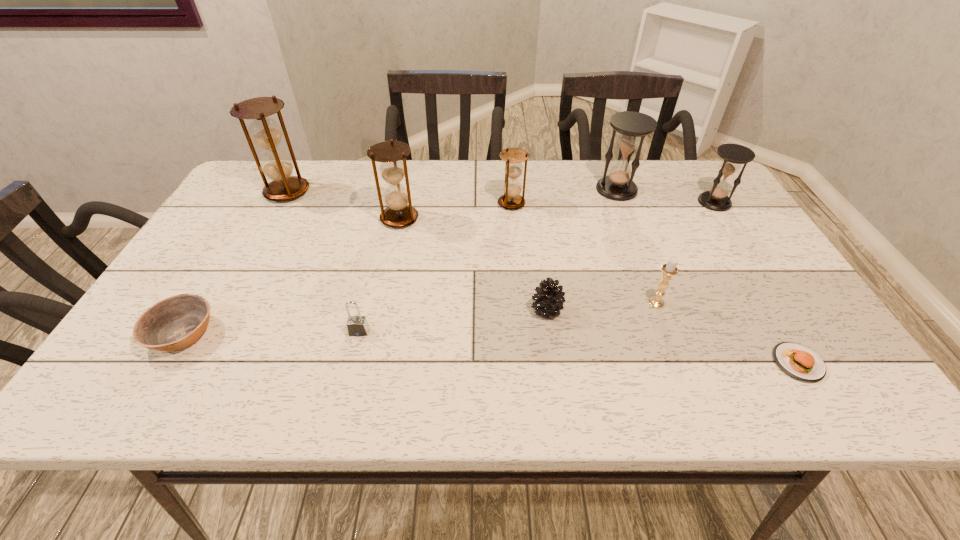
Locate an element on the screen. vacant region located on the left of the sixth tallest object is located at coordinates (626, 302).

This screenshot has width=960, height=540. What are the coordinates of `vacant region located on the back of the brown pinecone` in the screenshot? It's located at (535, 227).

Find the location of a particular element. vacant space situated 0.110m on the shackle of the gray padlock is located at coordinates (348, 382).

This screenshot has width=960, height=540. What are the coordinates of `free space located on the back of the second shortest object` in the screenshot? It's located at (243, 232).

What are the coordinates of `free location located 0.180m on the back of the shortest object` in the screenshot? It's located at (749, 282).

At what (x,y) coordinates should I click in order to perform the action: click on object positioned at the near edge. Please return your answer as a coordinate pair (x, y). The width and height of the screenshot is (960, 540). Looking at the image, I should click on (798, 361).

Where is `hourglass that is positioned at the left edge`? This screenshot has height=540, width=960. hourglass that is positioned at the left edge is located at coordinates (276, 165).

The image size is (960, 540). Identify the location of bowl positioned at the left edge. (174, 323).

The height and width of the screenshot is (540, 960). Find the location of `hourglass present at the right edge`. hourglass present at the right edge is located at coordinates (716, 199).

Locate an element on the screen. This screenshot has width=960, height=540. food at the right edge is located at coordinates (798, 361).